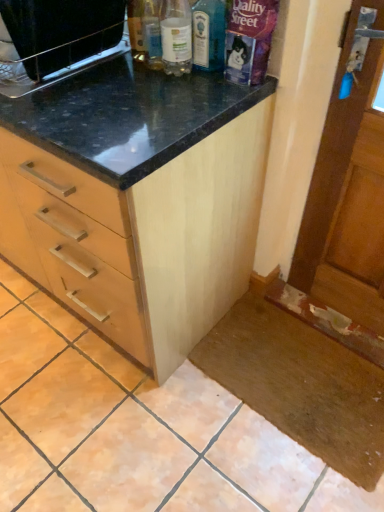
Find the location of a particular element. vacant area located to the right-hand side of black matte microwave at upper left is located at coordinates (138, 80).